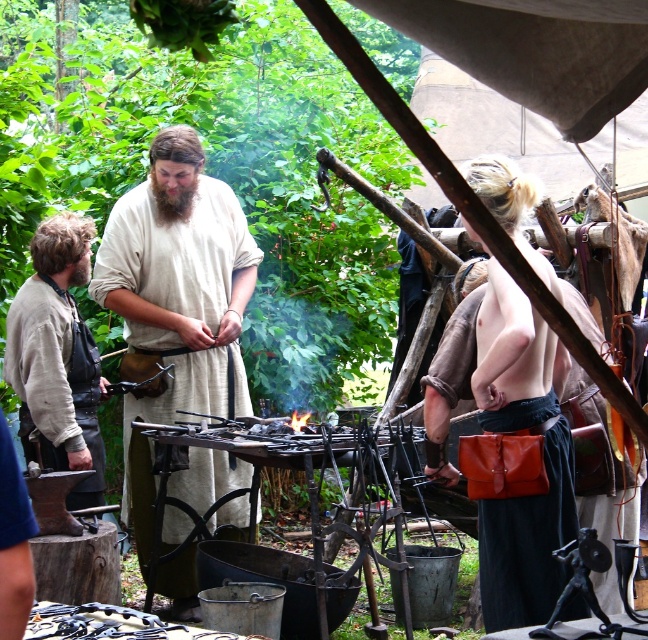
Question: Which object is the closest to the light beige fabric shirt at left?

Choices:
 (A) leather strap at center
 (B) beige linen tunic at center
 (C) leather belt at lower center

Answer: (B)

Question: Does beige linen tunic at center have a greater width compared to light beige fabric shirt at left?

Choices:
 (A) yes
 (B) no

Answer: (A)

Question: Is beige linen tunic at center below leather strap at center?

Choices:
 (A) yes
 (B) no

Answer: (A)

Question: Which point is farther from the camera taking this photo?

Choices:
 (A) (159, 163)
 (B) (518, 554)

Answer: (A)

Question: Considering the real-world distances, which object is farthest from the leather belt at lower center?

Choices:
 (A) leather strap at center
 (B) light beige fabric shirt at left
 (C) beige linen tunic at center

Answer: (B)

Question: Is light beige fabric shirt at left wider than leather belt at lower center?

Choices:
 (A) yes
 (B) no

Answer: (A)